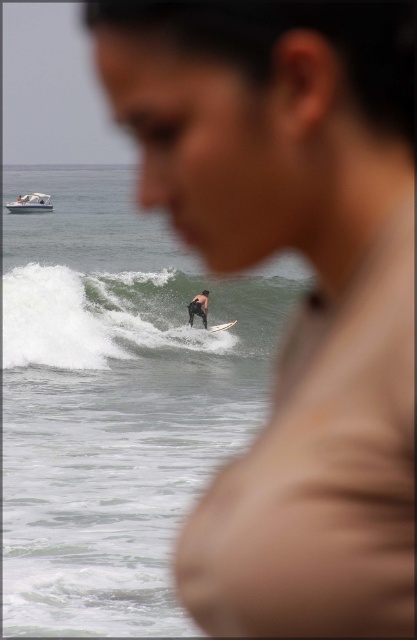
Question: Which object is the farthest from the white glossy surfboard at center?

Choices:
 (A) black neoprene wetsuit at center
 (B) white plastic boat at upper left
 (C) white foam wave at center

Answer: (B)

Question: Which point is closer to the camera?

Choices:
 (A) (22, 198)
 (B) (221, 328)
 (C) (216, 292)

Answer: (B)

Question: Can you confirm if white foam wave at center is bigger than white glossy surfboard at center?

Choices:
 (A) no
 (B) yes

Answer: (B)

Question: In this image, where is white plastic boat at upper left located relative to black neoprene wetsuit at center?

Choices:
 (A) below
 (B) above

Answer: (B)

Question: In this image, where is black neoprene wetsuit at center located relative to white glossy surfboard at center?

Choices:
 (A) right
 (B) left

Answer: (B)

Question: Which of the following is the farthest from the observer?

Choices:
 (A) white glossy surfboard at center
 (B) white foam wave at center
 (C) black neoprene wetsuit at center

Answer: (C)